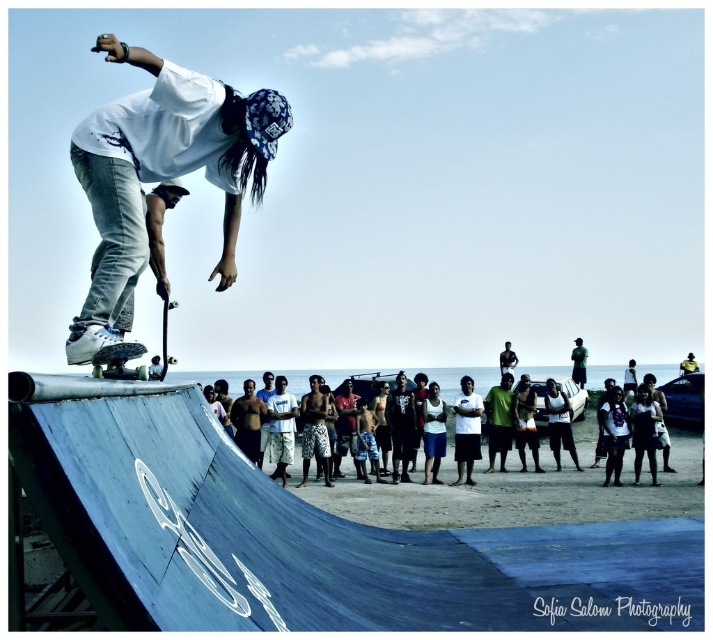
You are a photographer standing at the edge of the beach, aiming to capture the skateboarder and the dark brown woven fabric shirt at center in the same frame. Given that your camera has a maximum zoom of 100 meters, will you be able to include both subjects clearly in your photo?

The dark brown woven fabric shirt at center is 118.42 meters away from the viewer. Since the camera can only zoom up to 100 meters, the shirt will be out of the camera range and cannot be captured clearly in the same frame as the skateboarder.